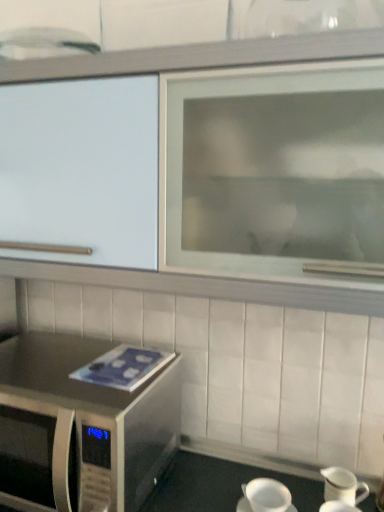
Question: Would you say white glossy pitcher at lower right, arranged as the 1th tableware when viewed from the back, is inside or outside stainless steel microwave at lower left?

Choices:
 (A) outside
 (B) inside

Answer: (A)

Question: Based on their sizes in the image, would you say white glossy pitcher at lower right, positioned as the second tableware in front-to-back order, is bigger or smaller than stainless steel microwave at lower left?

Choices:
 (A) big
 (B) small

Answer: (B)

Question: Which is farther from the white glossy pitcher at lower right, positioned as the second tableware in front-to-back order?

Choices:
 (A) stainless steel microwave at lower left
 (B) white glossy cabinet at upper center
 (C) white matte coffee cup at lower center
 (D) white glossy pitcher at lower right, the 1th tableware positioned from the front

Answer: (B)

Question: Estimate the real-world distances between objects in this image. Which object is closer to the white glossy cabinet at upper center?

Choices:
 (A) white glossy pitcher at lower right, arranged as the 1th tableware when viewed from the back
 (B) white glossy pitcher at lower right, positioned as the second tableware in back-to-front order
 (C) stainless steel microwave at lower left
 (D) white matte coffee cup at lower center

Answer: (C)